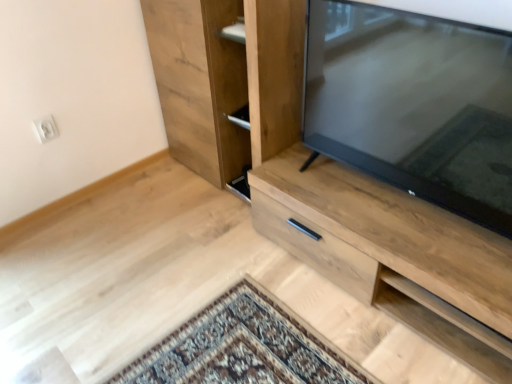
Question: Could natural wood cupboard at center be considered to be inside light wood cabinet at center?

Choices:
 (A) no
 (B) yes

Answer: (A)

Question: Can you confirm if light wood cabinet at center is wider than natural wood cupboard at center?

Choices:
 (A) yes
 (B) no

Answer: (A)

Question: Considering the relative positions of light wood cabinet at center and natural wood cupboard at center in the image provided, is light wood cabinet at center in front of natural wood cupboard at center?

Choices:
 (A) no
 (B) yes

Answer: (B)

Question: From the image's perspective, is light wood cabinet at center on top of natural wood cupboard at center?

Choices:
 (A) no
 (B) yes

Answer: (A)

Question: Considering the relative sizes of light wood cabinet at center and natural wood cupboard at center in the image provided, is light wood cabinet at center shorter than natural wood cupboard at center?

Choices:
 (A) yes
 (B) no

Answer: (A)

Question: From the image's perspective, is natural wood cupboard at center located above or below matte black tv at right?

Choices:
 (A) above
 (B) below

Answer: (A)

Question: Based on their sizes in the image, would you say natural wood cupboard at center is bigger or smaller than matte black tv at right?

Choices:
 (A) small
 (B) big

Answer: (B)

Question: From a real-world perspective, is natural wood cupboard at center above or below matte black tv at right?

Choices:
 (A) below
 (B) above

Answer: (A)

Question: In the image, is natural wood cupboard at center on the left side or the right side of matte black tv at right?

Choices:
 (A) right
 (B) left

Answer: (B)

Question: Is matte black tv at right wider or thinner than natural wood cupboard at center?

Choices:
 (A) thin
 (B) wide

Answer: (A)

Question: Visually, is matte black tv at right positioned to the left or to the right of natural wood cupboard at center?

Choices:
 (A) right
 (B) left

Answer: (A)

Question: Choose the correct answer: Is matte black tv at right inside natural wood cupboard at center or outside it?

Choices:
 (A) outside
 (B) inside

Answer: (A)

Question: From the image's perspective, is matte black tv at right positioned above or below natural wood cupboard at center?

Choices:
 (A) above
 (B) below

Answer: (B)

Question: Considering their positions, is light wood cabinet at center located in front of or behind natural wood cupboard at center?

Choices:
 (A) front
 (B) behind

Answer: (A)

Question: From the image's perspective, is light wood cabinet at center located above or below natural wood cupboard at center?

Choices:
 (A) below
 (B) above

Answer: (A)